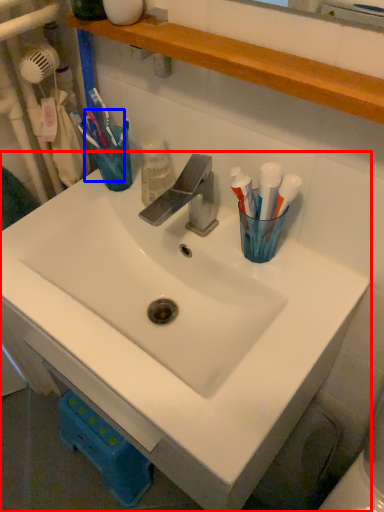
Question: Among these objects, which one is nearest to the camera, sink (highlighted by a red box) or toothbrush (highlighted by a blue box)?

Choices:
 (A) sink
 (B) toothbrush

Answer: (A)